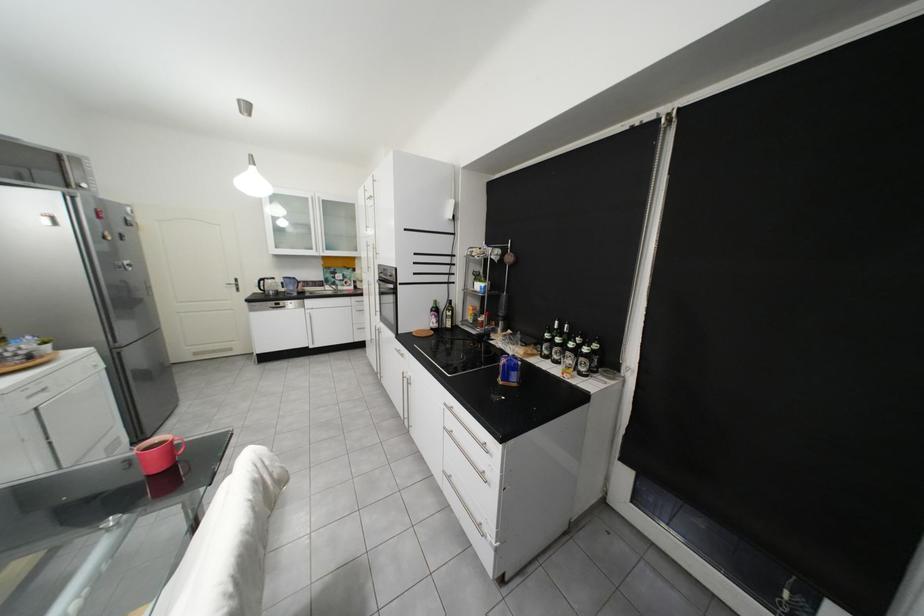
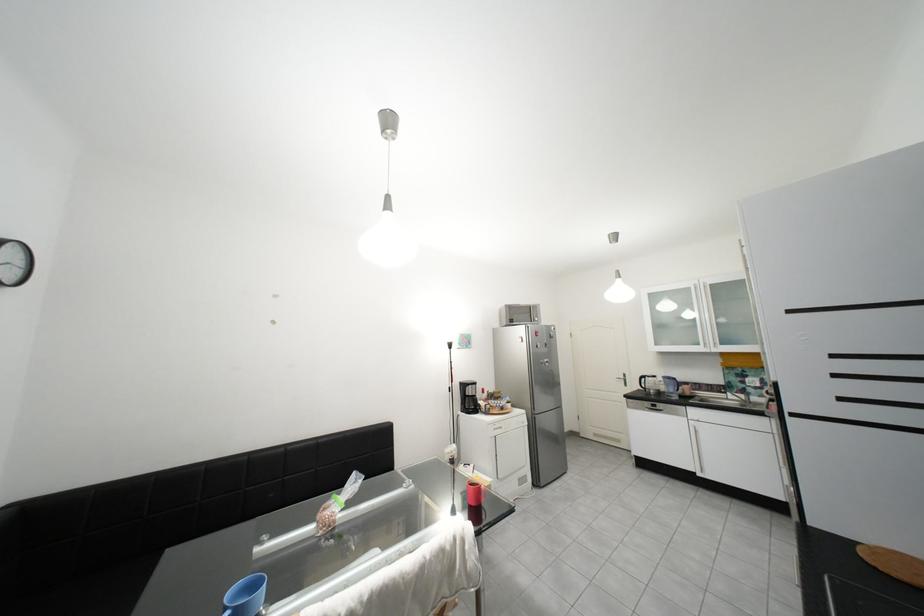
Question: The camera is either moving clockwise (left) or counter-clockwise (right) around the object. The first image is from the beginning of the video and the second image is from the end. Is the camera moving left or right when shooting the video?

Choices:
 (A) Left
 (B) Right

Answer: (B)